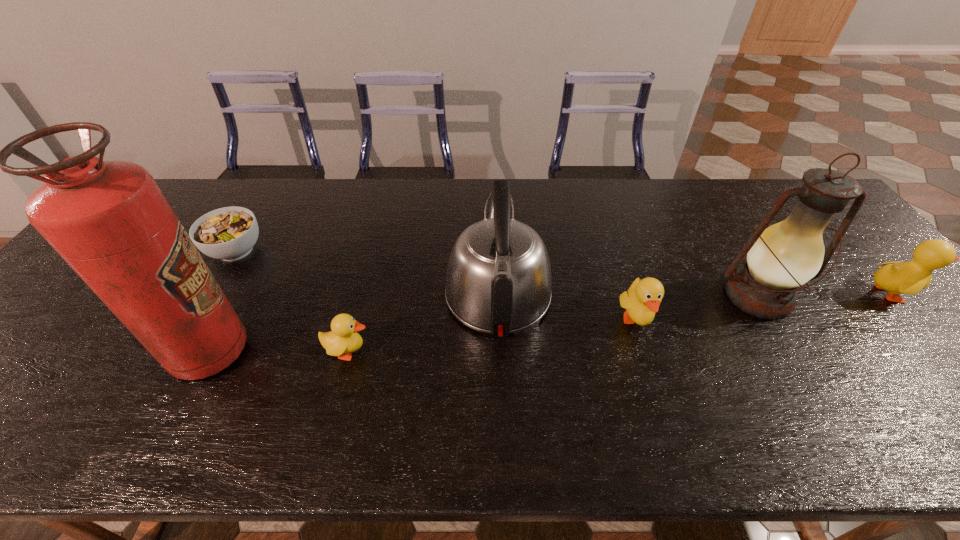
Find the location of a particular element. This screenshot has height=540, width=960. free space between the second duckling from left to right and the fire extinguisher is located at coordinates (422, 336).

Identify the location of free point between the third tallest object and the leftmost duckling. (423, 322).

Locate an element on the screen. This screenshot has height=540, width=960. free area in between the leftmost duckling and the fire extinguisher is located at coordinates (279, 352).

Image resolution: width=960 pixels, height=540 pixels. In order to click on free spot between the fourth object from right to left and the shortest duckling in this screenshot , I will do `click(423, 322)`.

Where is `object that ranks as the closest to the shortest duckling`? Image resolution: width=960 pixels, height=540 pixels. object that ranks as the closest to the shortest duckling is located at coordinates (498, 281).

I want to click on object that stands as the sixth closest to the second shortest object, so click(x=911, y=277).

Select which duckling appears as the closest to the fifth object from left to right. Please provide its 2D coordinates. Your answer should be formatted as a tuple, i.e. [(x, y)], where the tuple contains the x and y coordinates of a point satisfying the conditions above.

[(911, 277)]

Locate which duckling is the third closest to the tallest object. Please provide its 2D coordinates. Your answer should be formatted as a tuple, i.e. [(x, y)], where the tuple contains the x and y coordinates of a point satisfying the conditions above.

[(911, 277)]

You are a GUI agent. You are given a task and a screenshot of the screen. Output one action in this format:
    pyautogui.click(x=<x>, y=<y>)
    Task: Click on the vacant position in the image that satisfies the following two spatial constraints: 1. on the front-facing side of the rightmost object; 2. on the front-facing side of the second shortest duckling
    This screenshot has height=540, width=960.
    Given the screenshot: What is the action you would take?
    pyautogui.click(x=916, y=320)

At what (x,y) coordinates should I click in order to perform the action: click on free spot that satisfies the following two spatial constraints: 1. on the front-facing side of the second duckling from right to left; 2. on the label side of the tallest object. Please return your answer as a coordinate pair (x, y). Looking at the image, I should click on pos(646,352).